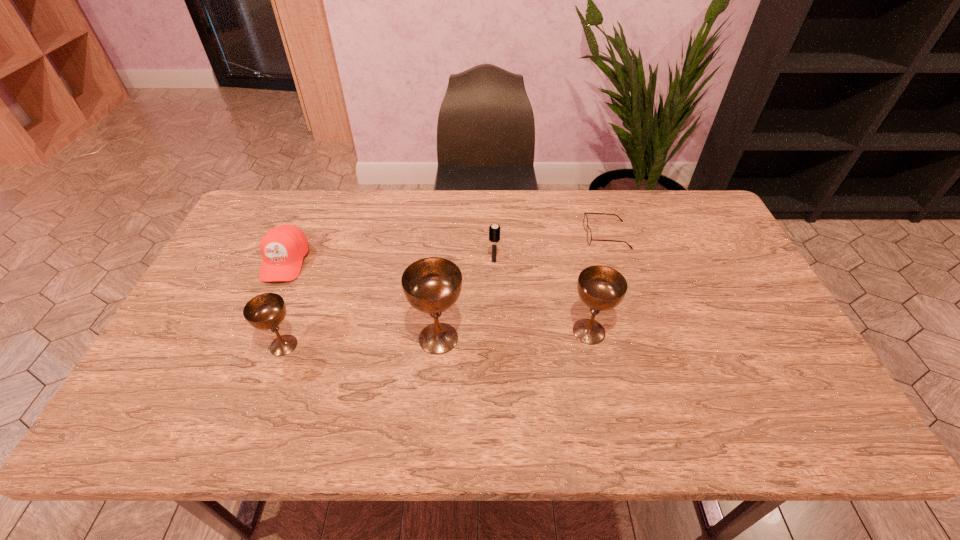
This screenshot has height=540, width=960. I want to click on the leftmost chalice, so click(266, 311).

The height and width of the screenshot is (540, 960). Find the location of `the tallest object`. the tallest object is located at coordinates (432, 285).

Identify the location of the tallest chalice. (432, 285).

Identify the location of the rightmost chalice. (602, 288).

Find the location of a particular element. the fifth shortest object is located at coordinates (602, 288).

Identify the location of baseball cap. The image size is (960, 540). (283, 248).

In order to click on the fourth object from left to right in this screenshot , I will do `click(494, 230)`.

Locate an element on the screen. The width and height of the screenshot is (960, 540). spectacles is located at coordinates (589, 236).

At what (x,y) coordinates should I click in order to perform the action: click on vacant area situated on the right of the leftmost chalice. Please return your answer as a coordinate pair (x, y). This screenshot has height=540, width=960. Looking at the image, I should click on (329, 345).

This screenshot has width=960, height=540. Identify the location of vacant space located on the right of the tallest object. (615, 338).